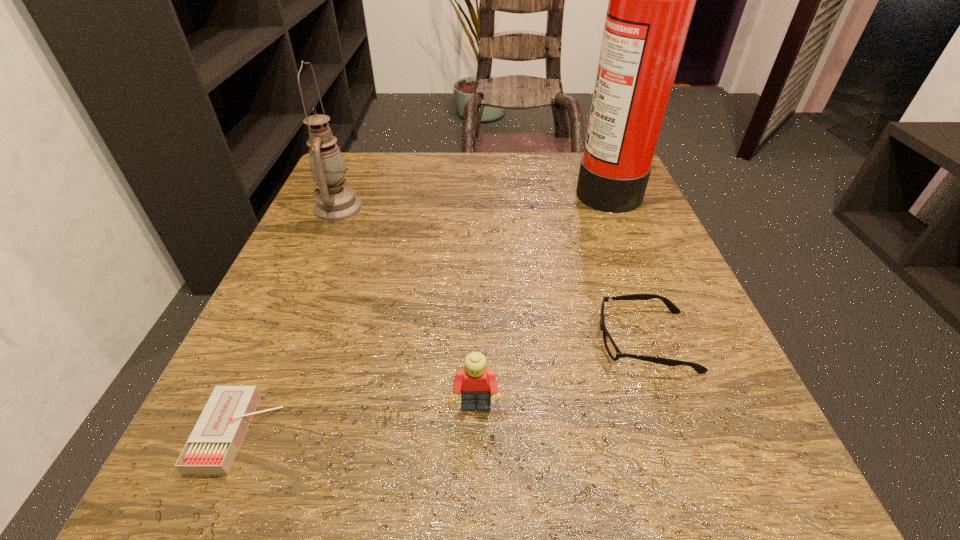
Where is `vacant space at the far left corner`? Image resolution: width=960 pixels, height=540 pixels. vacant space at the far left corner is located at coordinates (361, 167).

At what (x,y) coordinates should I click in order to perform the action: click on vacant area between the third farthest object and the shortest object. Please return your answer as a coordinate pair (x, y). This screenshot has width=960, height=540. Looking at the image, I should click on click(443, 387).

Where is `free space that is in between the fire extinguisher and the fourth shortest object`? This screenshot has height=540, width=960. free space that is in between the fire extinguisher and the fourth shortest object is located at coordinates (472, 197).

This screenshot has width=960, height=540. What are the coordinates of `free space between the third tallest object and the oil lamp` in the screenshot? It's located at (407, 307).

You are a GUI agent. You are given a task and a screenshot of the screen. Output one action in this format:
    pyautogui.click(x=<x>, y=<y>)
    Task: Click on the free space between the third object from right to left and the oil lamp
    Image resolution: width=960 pixels, height=540 pixels.
    Given the screenshot: What is the action you would take?
    pyautogui.click(x=407, y=307)

In order to click on free space that is in between the tallest object and the shortest object in this screenshot , I will do `click(422, 309)`.

Where is `vacant area that lies between the Lego and the fire extinguisher`? This screenshot has height=540, width=960. vacant area that lies between the Lego and the fire extinguisher is located at coordinates (540, 297).

Where is `free space between the third nearest object and the third object from left to right`? The image size is (960, 540). free space between the third nearest object and the third object from left to right is located at coordinates (561, 374).

I want to click on empty location between the second tallest object and the Lego, so click(x=407, y=307).

Identify the location of unoccupied position between the tallest object and the spectacles. This screenshot has width=960, height=540. (626, 264).